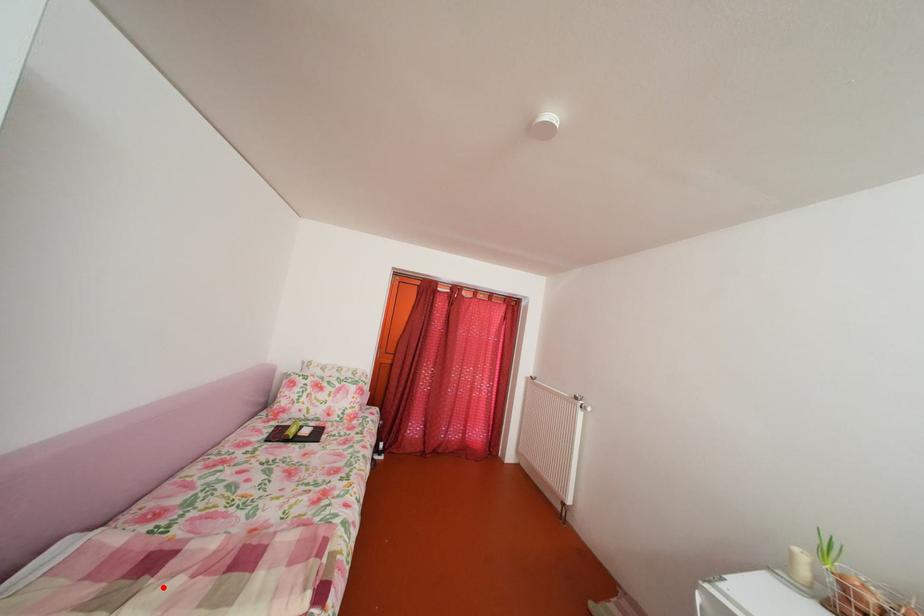
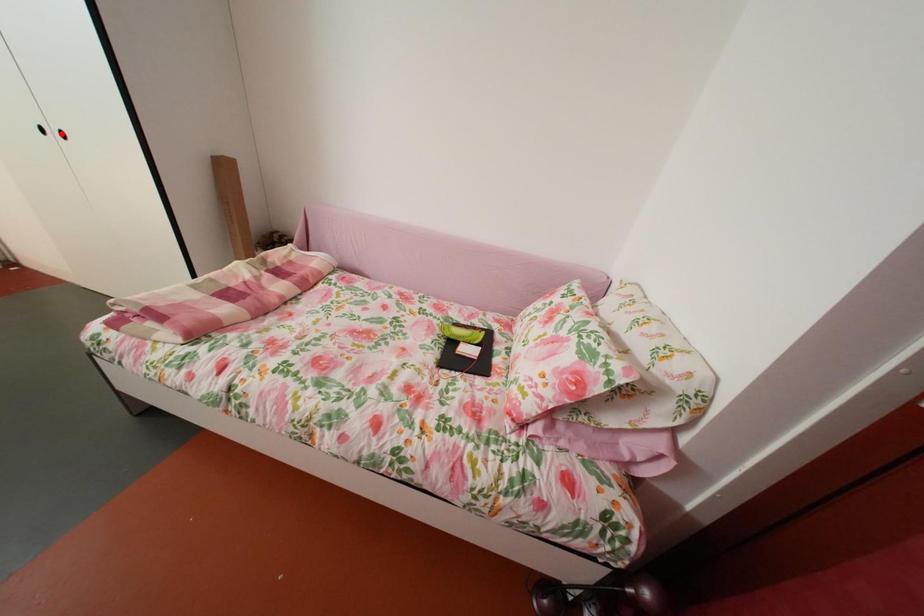
I am providing you with two images of the same scene from different viewpoints. A red point is marked on the first image and another point is marked on the second image. Does the point marked in image1 correspond to the same location as the one in image2?

No